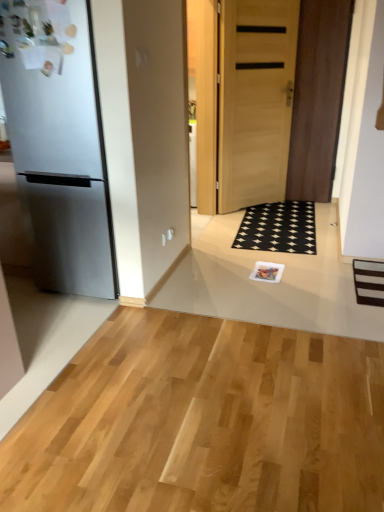
Question: Which is correct: satin black refrigerator at left is inside black rubber doormat at center, or outside of it?

Choices:
 (A) outside
 (B) inside

Answer: (A)

Question: In terms of height, does satin black refrigerator at left look taller or shorter compared to black rubber doormat at center?

Choices:
 (A) short
 (B) tall

Answer: (B)

Question: Based on their relative distances, which object is nearer to the light brown wood door at center, acting as the second door starting from the right?

Choices:
 (A) matte plastic magazine at center
 (B) satin black refrigerator at left
 (C) light brown wood door at center, positioned as the 2th door in left-to-right order
 (D) black rubber doormat at center

Answer: (C)

Question: Considering the real-world distances, which object is closest to the light brown wood door at center, acting as the second door starting from the right?

Choices:
 (A) matte plastic magazine at center
 (B) light brown wood door at center, positioned as the 2th door in left-to-right order
 (C) satin black refrigerator at left
 (D) black rubber doormat at center

Answer: (B)